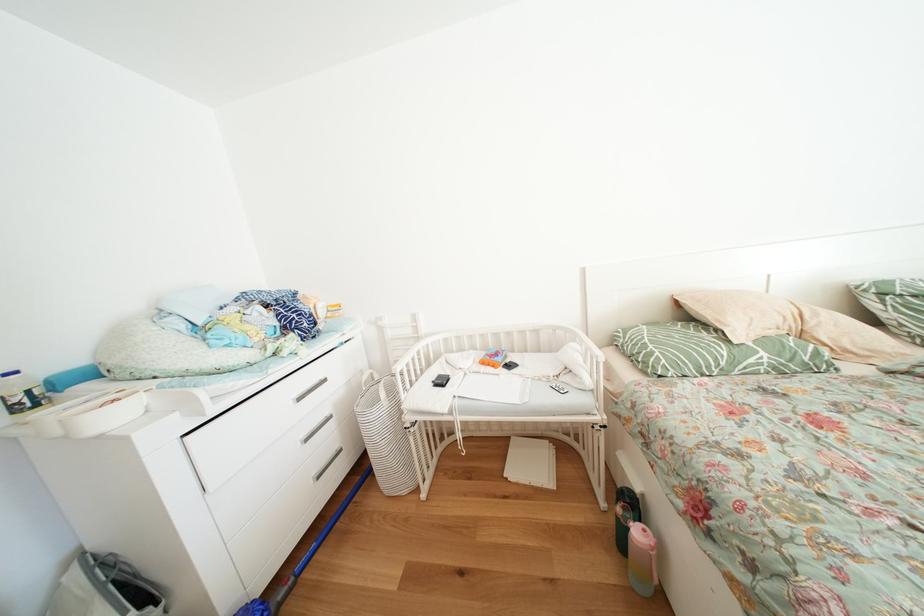
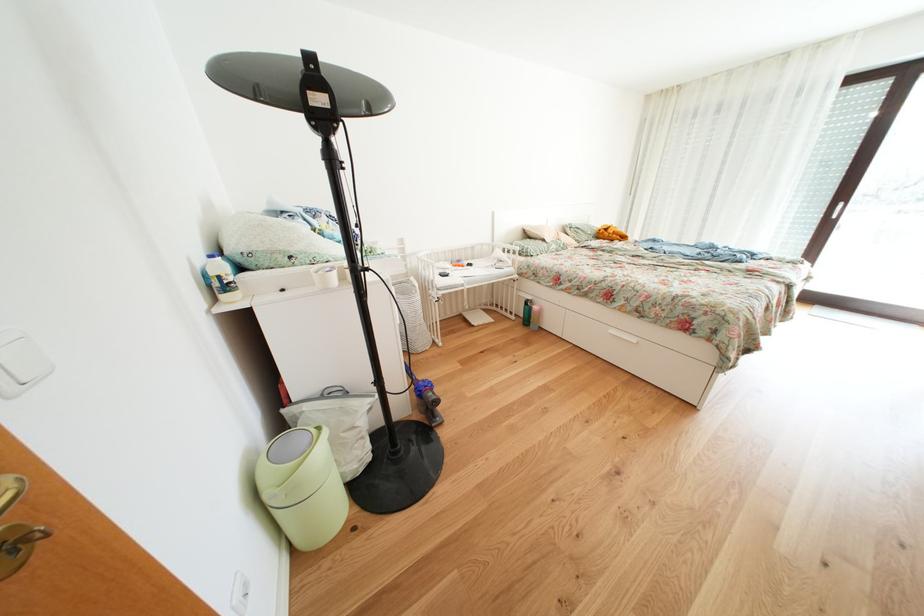
Find the pixel in the second image that matches [612,509] in the first image.

(523, 323)